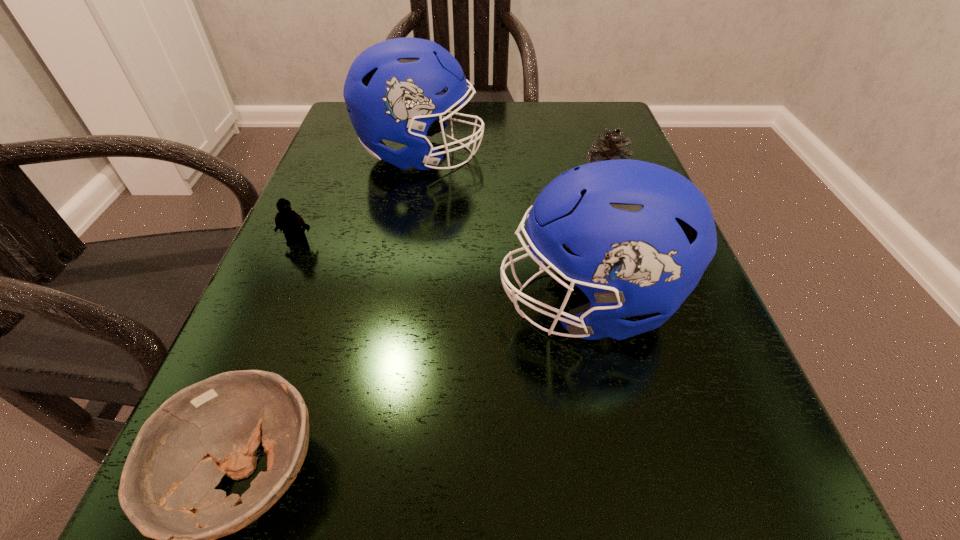
Where is `free point located on the face of the Lego`? free point located on the face of the Lego is located at coordinates (280, 281).

Where is `object at the far edge`? Image resolution: width=960 pixels, height=540 pixels. object at the far edge is located at coordinates (390, 90).

At what (x,y) coordinates should I click in order to perform the action: click on football helmet present at the left edge. Please return your answer as a coordinate pair (x, y). The height and width of the screenshot is (540, 960). Looking at the image, I should click on (390, 90).

Find the location of a particular element. Lego at the left edge is located at coordinates (293, 226).

You are a GUI agent. You are given a task and a screenshot of the screen. Output one action in this format:
    pyautogui.click(x=<x>, y=<y>)
    Task: Click on the football helmet that is at the right edge
    
    Given the screenshot: What is the action you would take?
    pyautogui.click(x=636, y=237)

Where is `pinecone that is at the right edge`? This screenshot has width=960, height=540. pinecone that is at the right edge is located at coordinates (611, 143).

Identify the location of object that is at the far left corner. The width and height of the screenshot is (960, 540). (390, 90).

In the image, there is a desktop. Identify the location of vacant space at the far edge. Image resolution: width=960 pixels, height=540 pixels. (529, 131).

The image size is (960, 540). Identify the location of free space at the near edge of the desktop. (539, 506).

In the image, there is a desktop. Where is `vacant space at the left edge`? The width and height of the screenshot is (960, 540). vacant space at the left edge is located at coordinates [x=328, y=229].